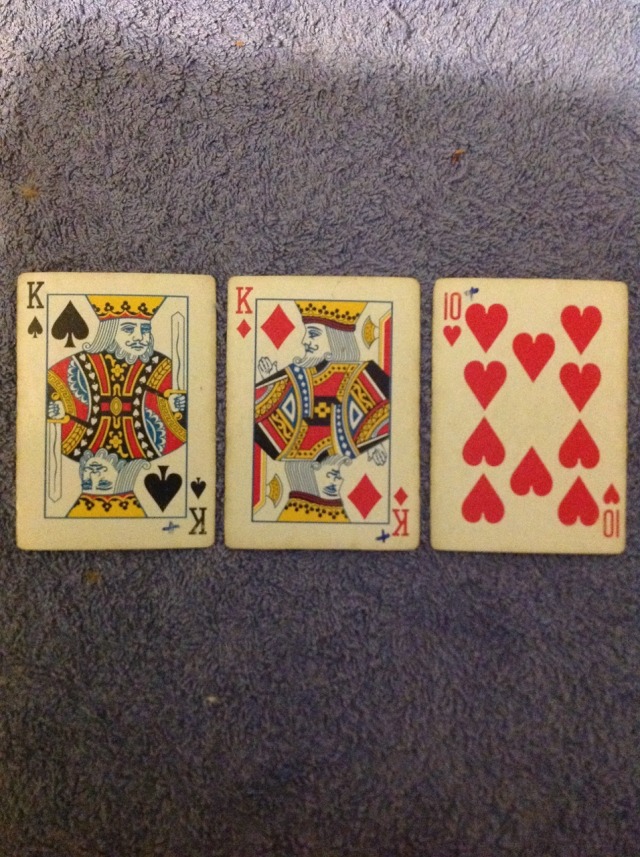
Find the location of a particular element. playing cards is located at coordinates (84, 277), (281, 285), (516, 296).